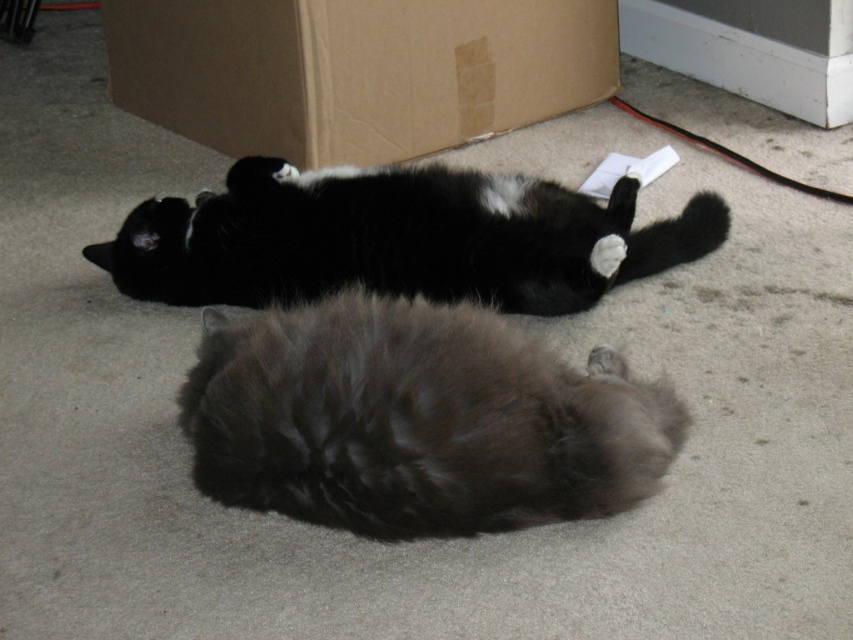
Question: Is the position of fluffy gray cat at center less distant than that of white glossy baseboard at upper right?

Choices:
 (A) yes
 (B) no

Answer: (A)

Question: Can you confirm if fluffy gray cat at center is positioned to the right of cardboard box at upper center?

Choices:
 (A) no
 (B) yes

Answer: (B)

Question: Which object is positioned closest to the black fur cat at upper center?

Choices:
 (A) white glossy baseboard at upper right
 (B) fluffy gray cat at center
 (C) cardboard box at upper center

Answer: (B)

Question: Considering the real-world distances, which object is farthest from the black fur cat at upper center?

Choices:
 (A) fluffy gray cat at center
 (B) white glossy baseboard at upper right
 (C) cardboard box at upper center

Answer: (B)

Question: Which point appears farthest from the camera in this image?

Choices:
 (A) (683, 209)
 (B) (238, 97)

Answer: (B)

Question: Does cardboard box at upper center have a greater width compared to white glossy baseboard at upper right?

Choices:
 (A) no
 (B) yes

Answer: (B)